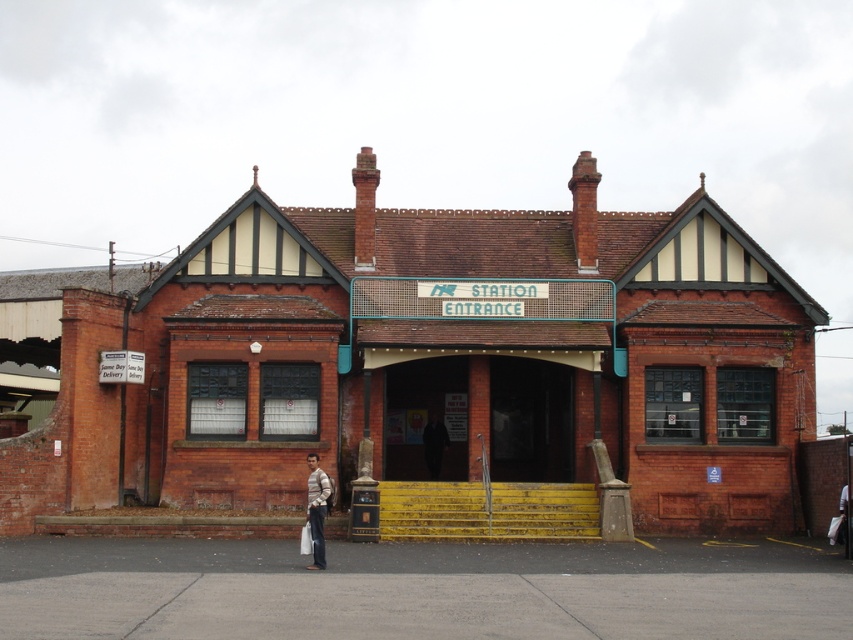
You are standing at the entrance of the brick building at center and want to hang the dark brown leather jacket at center on a hook inside. Since both are at the center, can you reach the jacket from where you are?

The brick building at center is closer to the viewer than the dark brown leather jacket at center, so you cannot reach the jacket from your current position inside the building because it is further away.